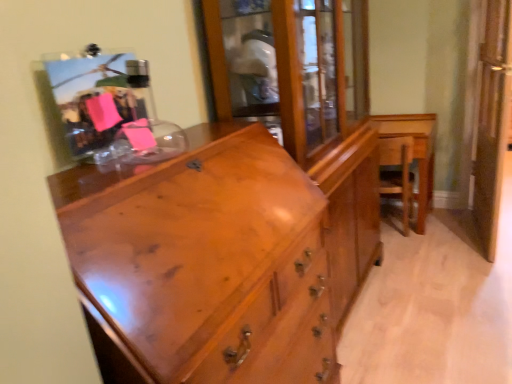
Question: Should I look upward or downward to see shiny brown wood chest of drawers at center?

Choices:
 (A) up
 (B) down

Answer: (B)

Question: Is shiny brown wood chest of drawers at center not near wooden table at right?

Choices:
 (A) yes
 (B) no

Answer: (A)

Question: Considering the relative sizes of shiny brown wood chest of drawers at center and wooden table at right in the image provided, is shiny brown wood chest of drawers at center shorter than wooden table at right?

Choices:
 (A) yes
 (B) no

Answer: (B)

Question: From a real-world perspective, is shiny brown wood chest of drawers at center beneath wooden table at right?

Choices:
 (A) no
 (B) yes

Answer: (A)

Question: Is shiny brown wood chest of drawers at center next to wooden table at right?

Choices:
 (A) no
 (B) yes

Answer: (A)

Question: Can you confirm if shiny brown wood chest of drawers at center is positioned to the left of wooden table at right?

Choices:
 (A) no
 (B) yes

Answer: (B)

Question: Is shiny brown wood chest of drawers at center oriented away from wooden table at right?

Choices:
 (A) yes
 (B) no

Answer: (B)

Question: Considering the relative positions of clear glass screen door at right and wooden table at right in the image provided, is clear glass screen door at right in front of wooden table at right?

Choices:
 (A) yes
 (B) no

Answer: (A)

Question: Is clear glass screen door at right to the left of wooden table at right from the viewer's perspective?

Choices:
 (A) yes
 (B) no

Answer: (B)

Question: Can wooden table at right be found inside clear glass screen door at right?

Choices:
 (A) no
 (B) yes

Answer: (A)

Question: Considering the relative sizes of clear glass screen door at right and wooden table at right in the image provided, is clear glass screen door at right smaller than wooden table at right?

Choices:
 (A) yes
 (B) no

Answer: (A)

Question: Could you tell me if clear glass screen door at right is facing wooden table at right?

Choices:
 (A) yes
 (B) no

Answer: (B)

Question: Would you say clear glass screen door at right is outside wooden table at right?

Choices:
 (A) no
 (B) yes

Answer: (B)

Question: Can you confirm if wooden armchair at right is taller than wooden table at right?

Choices:
 (A) yes
 (B) no

Answer: (B)